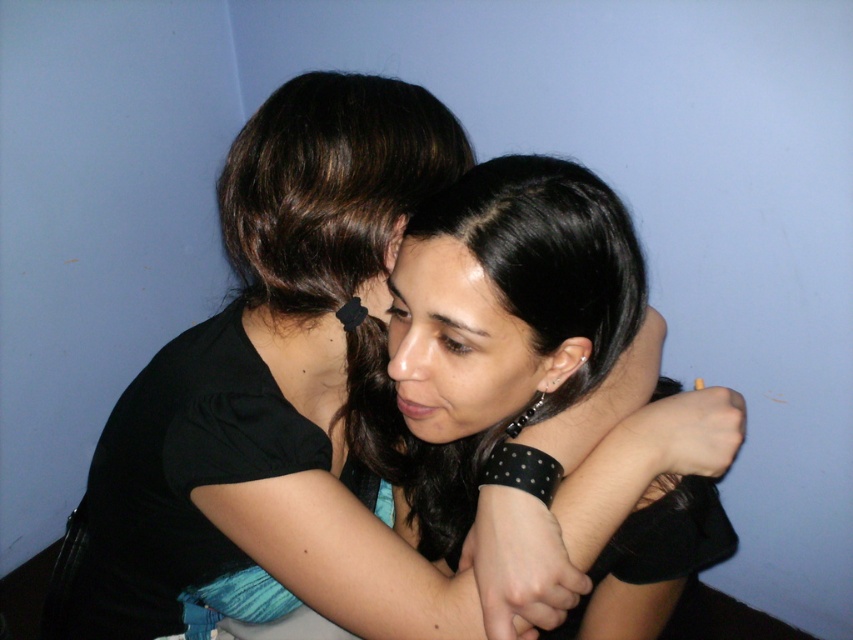
Based on the photo, is black dotted bracelet at center above smooth skin forehead at center?

No.

Can you confirm if black dotted bracelet at center is bigger than smooth skin forehead at center?

Yes, black dotted bracelet at center is bigger than smooth skin forehead at center.

Who is more forward, (x=486, y=612) or (x=416, y=262)?

Point (x=416, y=262) is more forward.

Locate an element on the screen. black dotted bracelet at center is located at coordinates (506, 358).

What do you see at coordinates (277, 392) in the screenshot? I see `black matte shirt at center` at bounding box center [277, 392].

Does black matte shirt at center appear on the right side of smooth skin forehead at center?

Incorrect, black matte shirt at center is not on the right side of smooth skin forehead at center.

Consider the image. Who is more distant from viewer, (444, 602) or (453, 253)?

The point (444, 602) is more distant.

Identify the location of black matte shirt at center. click(x=277, y=392).

From the picture: Who is lower down, black matte shirt at center or black dotted bracelet at center?

Positioned lower is black matte shirt at center.

Is black matte shirt at center below black dotted bracelet at center?

Indeed, black matte shirt at center is positioned under black dotted bracelet at center.

The image size is (853, 640). What do you see at coordinates (277, 392) in the screenshot? I see `black matte shirt at center` at bounding box center [277, 392].

Find the location of a particular element. black matte shirt at center is located at coordinates (277, 392).